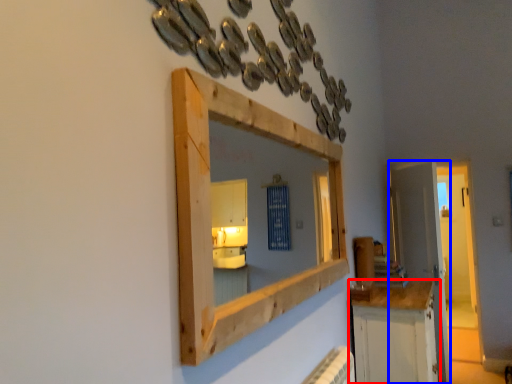
Question: Which object appears closest to the camera in this image, cabinetry (highlighted by a red box) or door (highlighted by a blue box)?

Choices:
 (A) cabinetry
 (B) door

Answer: (A)